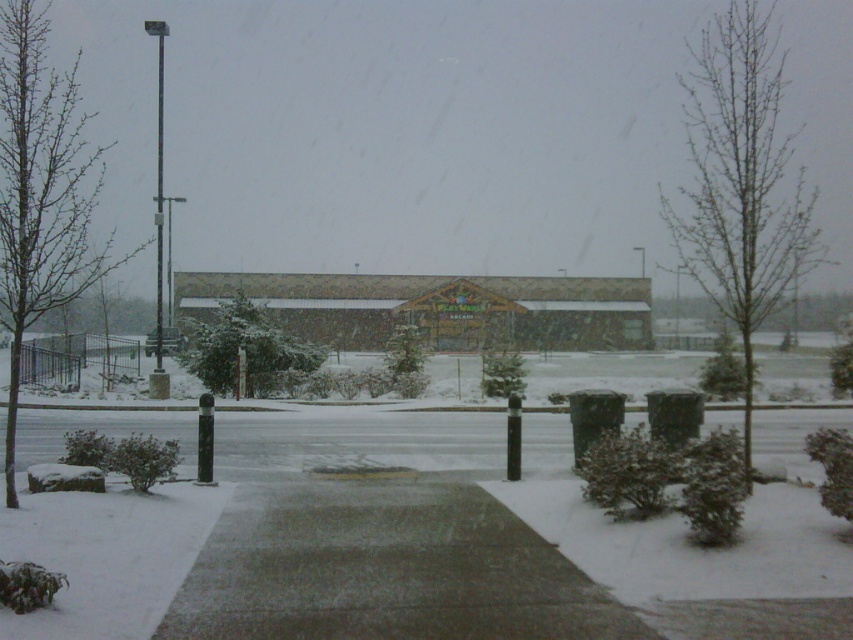
Question: Can you confirm if gray concrete sidewalk at center is positioned to the right of metallic pole at left?

Choices:
 (A) no
 (B) yes

Answer: (B)

Question: Is gray concrete sidewalk at center positioned before metallic pole at left?

Choices:
 (A) yes
 (B) no

Answer: (A)

Question: Which point appears closest to the camera in this image?

Choices:
 (A) (387, 534)
 (B) (165, 26)

Answer: (A)

Question: Does gray concrete sidewalk at center have a larger size compared to metallic pole at left?

Choices:
 (A) yes
 (B) no

Answer: (B)

Question: Which point is closer to the camera taking this photo?

Choices:
 (A) (160, 193)
 (B) (343, 566)

Answer: (B)

Question: Which point is closer to the camera taking this photo?

Choices:
 (A) (160, 44)
 (B) (457, 538)

Answer: (B)